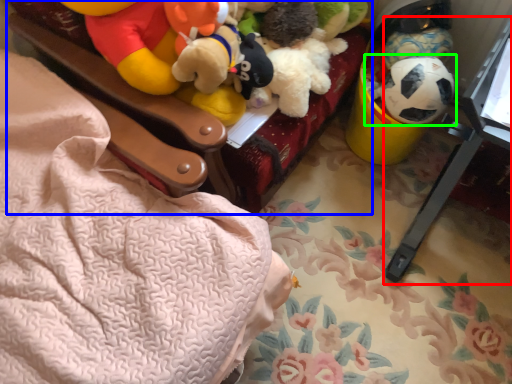
Question: Which object is positioned closest to changing table (highlighted by a red box)? Select from furniture (highlighted by a blue box) and toy (highlighted by a green box).

Choices:
 (A) furniture
 (B) toy

Answer: (B)